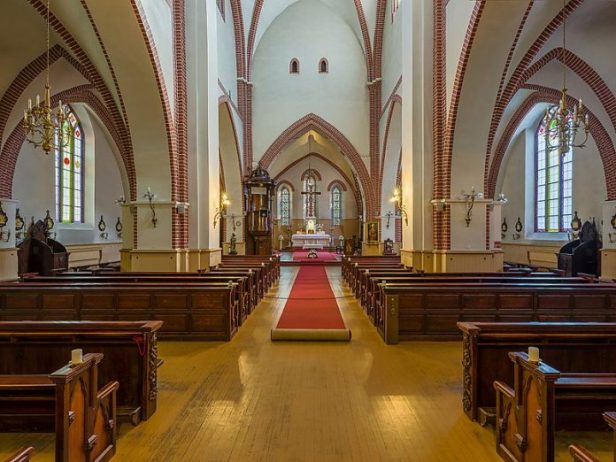
This screenshot has height=462, width=616. I want to click on candles, so click(x=583, y=103).